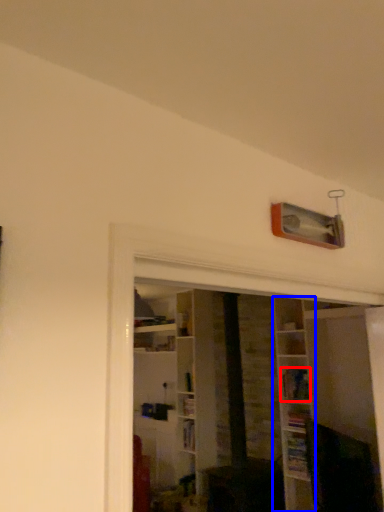
Question: Which object is closer to the camera taking this photo, book (highlighted by a red box) or shelf (highlighted by a blue box)?

Choices:
 (A) book
 (B) shelf

Answer: (B)